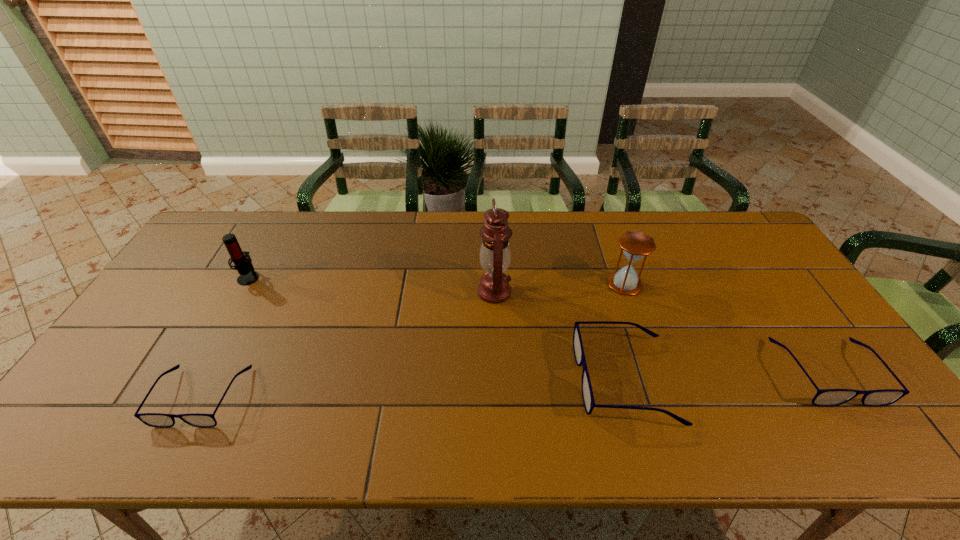
Locate an element on the screen. The width and height of the screenshot is (960, 540). free area in between the microphone and the hourglass is located at coordinates (437, 281).

You are a GUI agent. You are given a task and a screenshot of the screen. Output one action in this format:
    pyautogui.click(x=<x>, y=<y>)
    Task: Click on the free space between the microphone and the hourglass
    
    Given the screenshot: What is the action you would take?
    coord(437,281)

Where is `object that stands as the closest to the microphone`? object that stands as the closest to the microphone is located at coordinates (159, 420).

Identify which object is located as the second nearest to the shortest spectacles. Please provide its 2D coordinates. Your answer should be formatted as a tuple, i.e. [(x, y)], where the tuple contains the x and y coordinates of a point satisfying the conditions above.

[(495, 255)]

At what (x,y) coordinates should I click in order to perform the action: click on spectacles that is the second closest one to the shortest object. Please return your answer as a coordinate pair (x, y). Looking at the image, I should click on (825, 397).

Identify the location of spectacles object that ranks as the third closest to the microphone. This screenshot has width=960, height=540. (825, 397).

Where is `free spot that satisfies the following two spatial constraints: 1. on the front side of the oil lamp; 2. on the left side of the microphone`? The width and height of the screenshot is (960, 540). free spot that satisfies the following two spatial constraints: 1. on the front side of the oil lamp; 2. on the left side of the microphone is located at coordinates (241, 292).